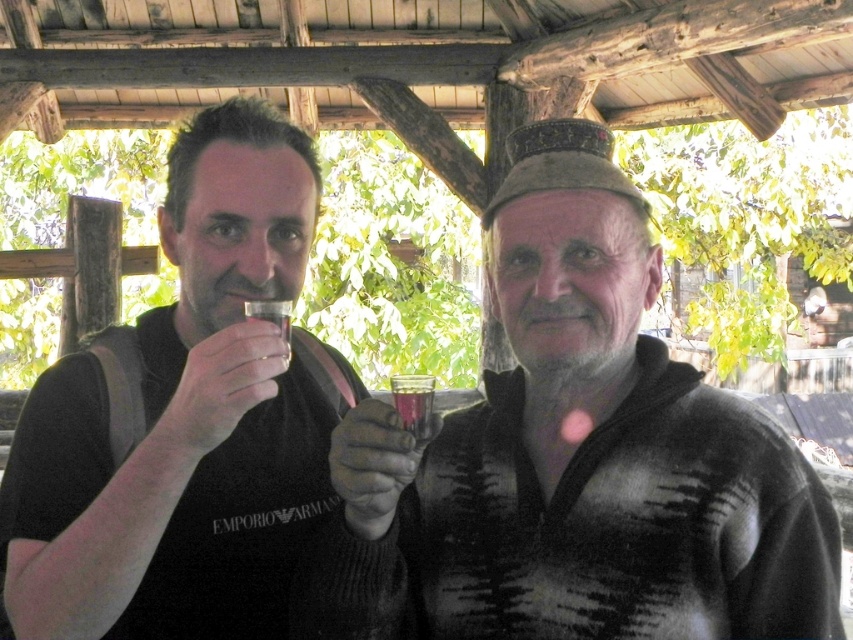
Question: In this image, where is matte black vest at left located relative to matte black hand at left?

Choices:
 (A) below
 (B) above

Answer: (B)

Question: Does matte black vest at left have a smaller size compared to pink translucent glass at center?

Choices:
 (A) no
 (B) yes

Answer: (A)

Question: Among these points, which one is farthest from the camera?

Choices:
 (A) (387, 520)
 (B) (198, 428)

Answer: (A)

Question: Based on their relative distances, which object is nearer to the translucent glass at center?

Choices:
 (A) matte brown hat at center
 (B) matte black hand at left
 (C) matte black vest at left
 (D) pink translucent glass at center

Answer: (D)

Question: Which point is farther to the camera?

Choices:
 (A) (387, 419)
 (B) (181, 387)
 (C) (387, 481)
 (D) (584, 296)

Answer: (D)

Question: In this image, where is matte brown hat at center located relative to clear glass at center?

Choices:
 (A) right
 (B) left

Answer: (A)